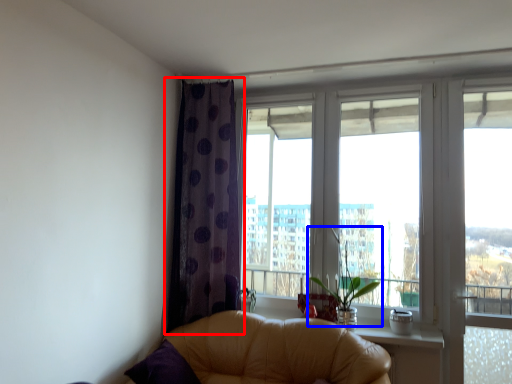
Question: Among these objects, which one is nearest to the camera, curtain (highlighted by a red box) or plant (highlighted by a blue box)?

Choices:
 (A) curtain
 (B) plant

Answer: (B)